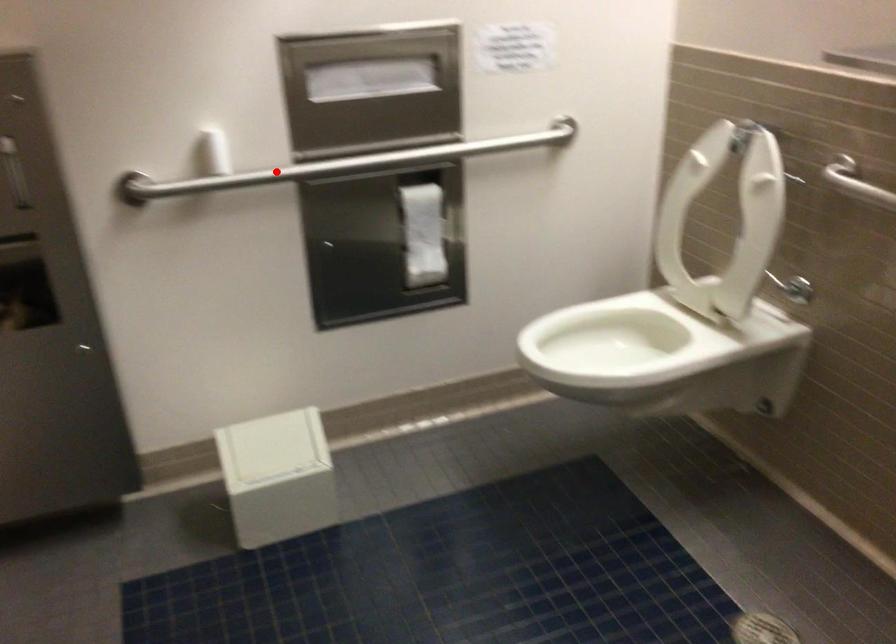
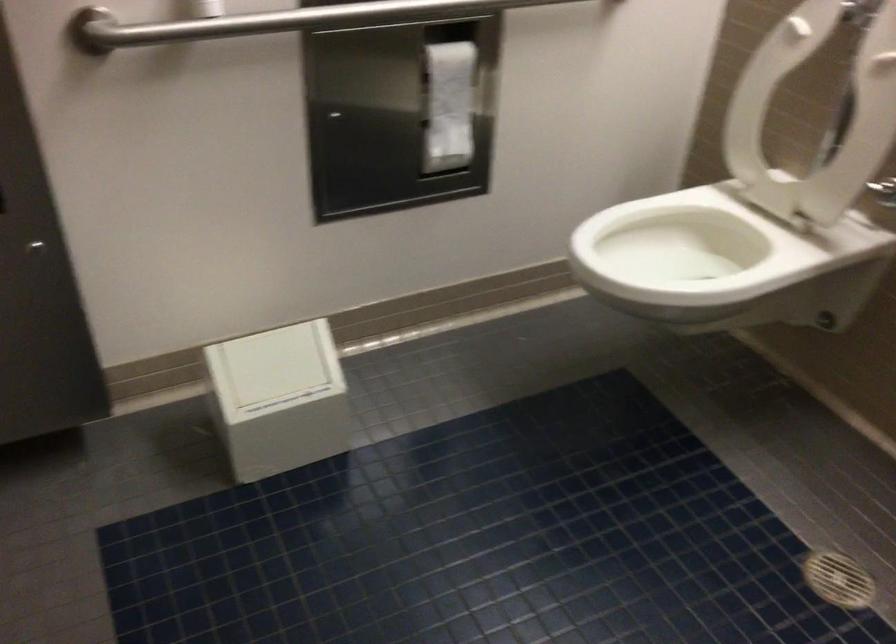
Question: I am providing you with two images of the same scene from different viewpoints. Image1 has a red point marked. In image2, the corresponding 3D location appears at what relative position? Reply with the corresponding letter.

Choices:
 (A) Closer
 (B) Farther

Answer: (A)